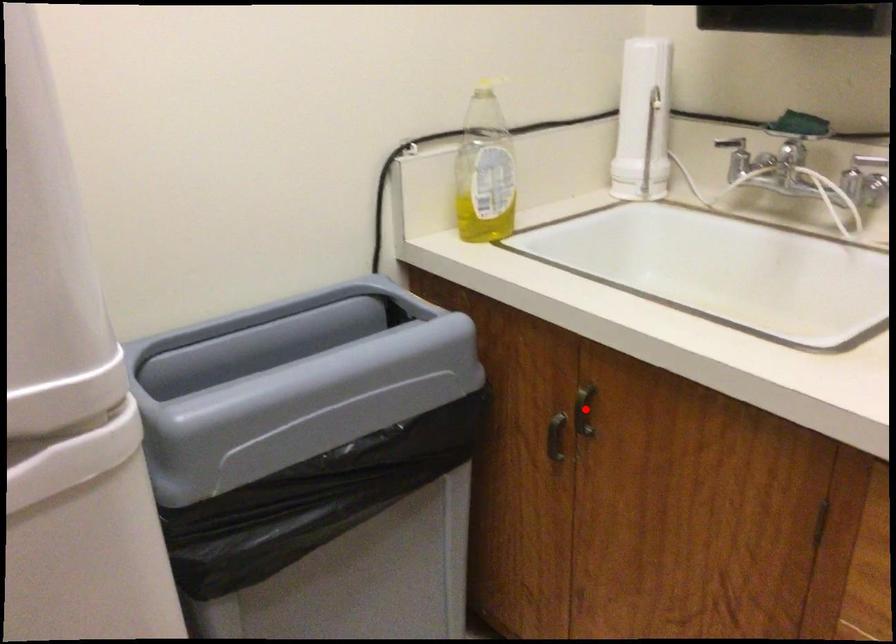
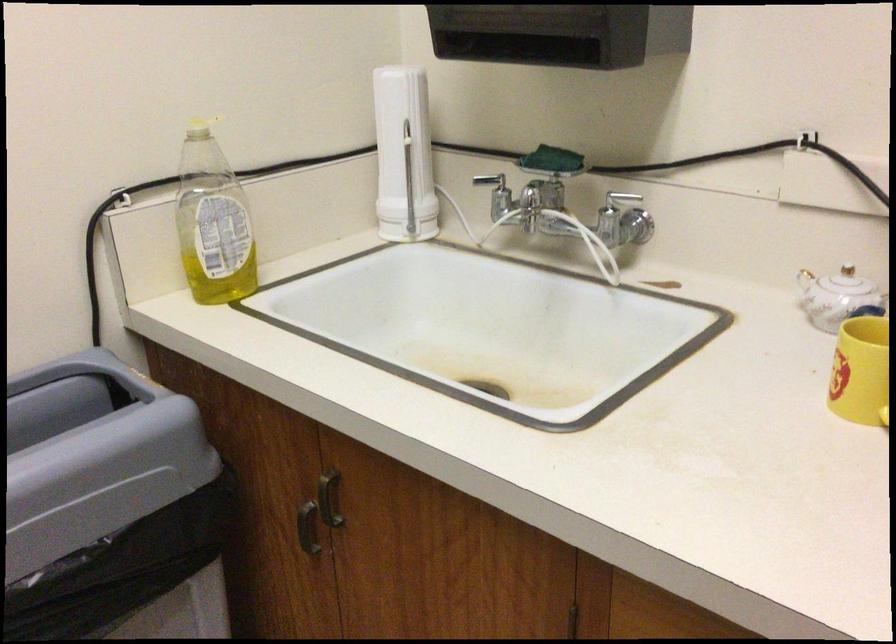
Where in the second image is the point corresponding to the highlighted location from the first image?

(328, 498)